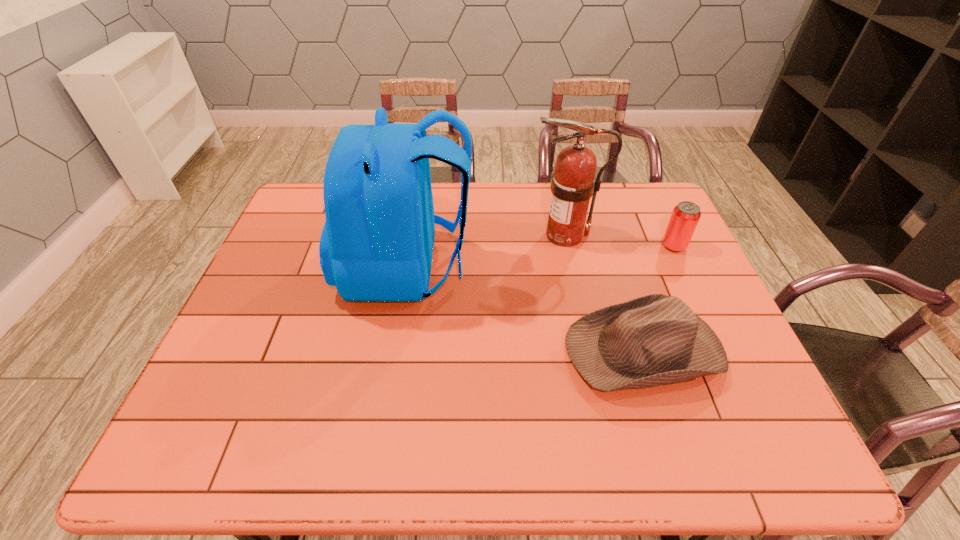
Find the location of a particular element. This screenshot has width=960, height=540. the leftmost object is located at coordinates (377, 242).

The height and width of the screenshot is (540, 960). In order to click on fire extinguisher in this screenshot , I will do `click(572, 185)`.

Locate an element on the screen. Image resolution: width=960 pixels, height=540 pixels. can is located at coordinates [x=685, y=216].

You are a GUI agent. You are given a task and a screenshot of the screen. Output one action in this format:
    pyautogui.click(x=<x>, y=<y>)
    Task: Click on the fedora
    
    Given the screenshot: What is the action you would take?
    pyautogui.click(x=654, y=340)

Locate an element on the screen. This screenshot has height=540, width=960. free space located on the back of the leftmost object is located at coordinates (582, 266).

Find the location of a particular element. free spot located 0.220m at the nozzle of the fire extinguisher is located at coordinates click(x=458, y=235).

Identify the location of vacant area situated 0.170m at the nozzle of the fire extinguisher. (474, 235).

Locate an element on the screen. The width and height of the screenshot is (960, 540). free space located 0.110m at the nozzle of the fire extinguisher is located at coordinates (493, 235).

You are a GUI agent. You are given a task and a screenshot of the screen. Output one action in this format:
    pyautogui.click(x=<x>, y=<y>)
    Task: Click on the free point located on the back of the can
    The width and height of the screenshot is (960, 540).
    Given the screenshot: What is the action you would take?
    pyautogui.click(x=645, y=185)

Find the location of a particular element. This screenshot has width=960, height=540. blank space located on the left of the fedora is located at coordinates (516, 348).